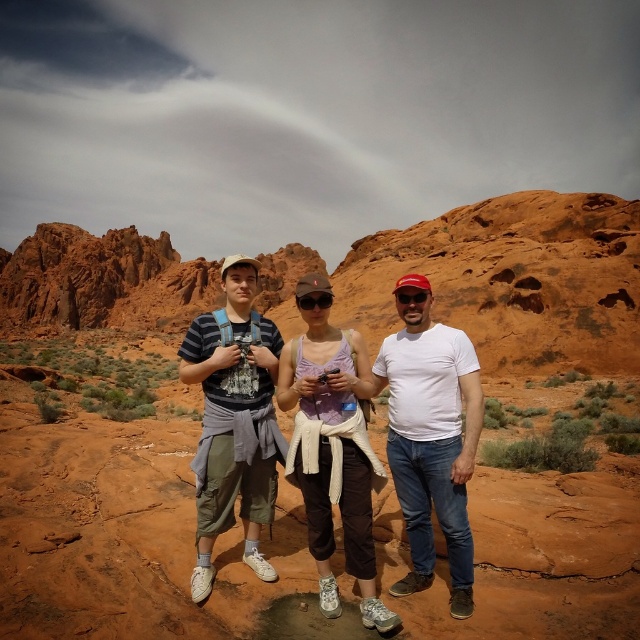
Question: Is white matte shirt at center below striped cotton shirt at center?

Choices:
 (A) no
 (B) yes

Answer: (B)

Question: Which object is closer to the camera taking this photo?

Choices:
 (A) white matte shirt at center
 (B) striped cotton shirt at center

Answer: (A)

Question: Which object appears closest to the camera in this image?

Choices:
 (A) striped cotton shirt at center
 (B) white matte shirt at center

Answer: (B)

Question: Can you confirm if white matte shirt at center is wider than striped cotton shirt at center?

Choices:
 (A) no
 (B) yes

Answer: (A)

Question: Does white matte shirt at center come behind striped cotton shirt at center?

Choices:
 (A) yes
 (B) no

Answer: (B)

Question: Which point is farther to the camera?

Choices:
 (A) striped cotton shirt at center
 (B) white matte shirt at center

Answer: (A)